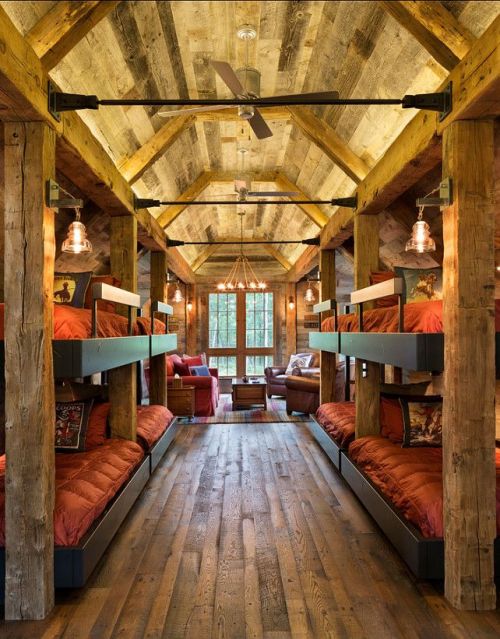
Locate an element on the screen. bed is located at coordinates (71, 470), (148, 420), (86, 333), (144, 323), (344, 318), (416, 319), (340, 417), (389, 471).